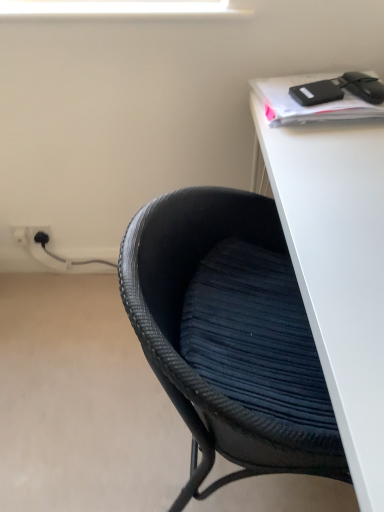
What do you see at coordinates (229, 334) in the screenshot? Image resolution: width=384 pixels, height=512 pixels. I see `black woven chair at lower left` at bounding box center [229, 334].

What do you see at coordinates (31, 234) in the screenshot?
I see `white plastic electric outlet at lower left, the 2th electric outlet when ordered from left to right` at bounding box center [31, 234].

The image size is (384, 512). I want to click on white matte desk at upper right, so click(x=334, y=259).

Identify the location of white plastic electric outlet at lower left, the 2th electric outlet when ordered from right to left. (20, 234).

Based on the photo, from the image's perspective, which is below, white plastic electric outlet at lower left, the 2th electric outlet when ordered from right to left, or white matte desk at upper right?

white matte desk at upper right is shown below in the image.

From a real-world perspective, is white plastic electric outlet at lower left, which ranks as the first electric outlet in left-to-right order, on white matte desk at upper right?

Actually, white plastic electric outlet at lower left, which ranks as the first electric outlet in left-to-right order, is physically below white matte desk at upper right in the real world.

Which is more to the right, white plastic electric outlet at lower left, which ranks as the first electric outlet in left-to-right order, or white matte desk at upper right?

white matte desk at upper right.

Looking at this image, considering the positions of objects white plastic electric outlet at lower left, which ranks as the first electric outlet in right-to-left order, and black woven chair at lower left in the image provided, who is more to the left, white plastic electric outlet at lower left, which ranks as the first electric outlet in right-to-left order, or black woven chair at lower left?

Positioned to the left is white plastic electric outlet at lower left, which ranks as the first electric outlet in right-to-left order.

Is white plastic electric outlet at lower left, the 2th electric outlet when ordered from left to right, positioned beyond the bounds of black woven chair at lower left?

Yes.

Is white plastic electric outlet at lower left, which ranks as the first electric outlet in right-to-left order, aimed at black woven chair at lower left?

No, white plastic electric outlet at lower left, which ranks as the first electric outlet in right-to-left order, is not aimed at black woven chair at lower left.

From the image's perspective, would you say white plastic electric outlet at lower left, which ranks as the first electric outlet in right-to-left order, is shown under black woven chair at lower left?

No.

Find the location of a particular element. electric outlet below the white plastic electric outlet at lower left, the 2th electric outlet when ordered from left to right (from a real-world perspective) is located at coordinates (20, 234).

Considering the points (42, 243) and (14, 234), which point is in front, point (42, 243) or point (14, 234)?

The point (14, 234) is closer.

Is white plastic electric outlet at lower left, which ranks as the first electric outlet in right-to-left order, placed right next to white plastic electric outlet at lower left, the 2th electric outlet when ordered from right to left?

Indeed, white plastic electric outlet at lower left, which ranks as the first electric outlet in right-to-left order, and white plastic electric outlet at lower left, the 2th electric outlet when ordered from right to left, are beside each other and touching.

Considering the sizes of objects white plastic electric outlet at lower left, which ranks as the first electric outlet in right-to-left order, and white plastic electric outlet at lower left, the 2th electric outlet when ordered from right to left, in the image provided, who is thinner, white plastic electric outlet at lower left, which ranks as the first electric outlet in right-to-left order, or white plastic electric outlet at lower left, the 2th electric outlet when ordered from right to left,?

white plastic electric outlet at lower left, which ranks as the first electric outlet in right-to-left order.

Which object is wider, white plastic electric outlet at lower left, which ranks as the first electric outlet in left-to-right order, or white plastic electric outlet at lower left, the 2th electric outlet when ordered from left to right?

With larger width is white plastic electric outlet at lower left, which ranks as the first electric outlet in left-to-right order.

The width and height of the screenshot is (384, 512). I want to click on electric outlet above the white plastic electric outlet at lower left, which ranks as the first electric outlet in left-to-right order (from the image's perspective), so click(x=31, y=234).

Is white plastic electric outlet at lower left, which ranks as the first electric outlet in left-to-right order, facing towards white plastic electric outlet at lower left, which ranks as the first electric outlet in right-to-left order?

No, white plastic electric outlet at lower left, which ranks as the first electric outlet in left-to-right order, is not facing towards white plastic electric outlet at lower left, which ranks as the first electric outlet in right-to-left order.

From the image's perspective, which one is positioned lower, white plastic electric outlet at lower left, the 2th electric outlet when ordered from right to left, or white plastic electric outlet at lower left, which ranks as the first electric outlet in right-to-left order?

white plastic electric outlet at lower left, the 2th electric outlet when ordered from right to left, appears lower in the image.

Locate an element on the screen. The width and height of the screenshot is (384, 512). the 1st electric outlet to the left of the white matte desk at upper right, starting your count from the anchor is located at coordinates (31, 234).

Considering the relative sizes of white matte desk at upper right and white plastic electric outlet at lower left, which ranks as the first electric outlet in right-to-left order, in the image provided, is white matte desk at upper right shorter than white plastic electric outlet at lower left, which ranks as the first electric outlet in right-to-left order,?

No, white matte desk at upper right is not shorter than white plastic electric outlet at lower left, which ranks as the first electric outlet in right-to-left order.

From a real-world perspective, is white matte desk at upper right physically above white plastic electric outlet at lower left, the 2th electric outlet when ordered from left to right?

Indeed, from a real-world perspective, white matte desk at upper right stands above white plastic electric outlet at lower left, the 2th electric outlet when ordered from left to right.

Which object is more forward, white matte desk at upper right or white plastic electric outlet at lower left, the 2th electric outlet when ordered from left to right?

white matte desk at upper right is closer to the camera.

From a real-world perspective, which is physically below, black woven chair at lower left or white matte desk at upper right?

black woven chair at lower left is physically lower.

Where is `desk in front of the black woven chair at lower left`? This screenshot has height=512, width=384. desk in front of the black woven chair at lower left is located at coordinates (334, 259).

From the image's perspective, would you say black woven chair at lower left is shown under white matte desk at upper right?

Yes.

Can you confirm if black woven chair at lower left is positioned to the right of white matte desk at upper right?

In fact, black woven chair at lower left is to the left of white matte desk at upper right.

Is white plastic electric outlet at lower left, the 2th electric outlet when ordered from left to right, surrounding white matte desk at upper right?

That's incorrect, white matte desk at upper right is not inside white plastic electric outlet at lower left, the 2th electric outlet when ordered from left to right.

Is white plastic electric outlet at lower left, which ranks as the first electric outlet in right-to-left order, facing towards white matte desk at upper right?

No.

From their relative heights in the image, would you say white plastic electric outlet at lower left, the 2th electric outlet when ordered from left to right, is taller or shorter than white matte desk at upper right?

Considering their sizes, white plastic electric outlet at lower left, the 2th electric outlet when ordered from left to right, has less height than white matte desk at upper right.

From the image's perspective, between white plastic electric outlet at lower left, which ranks as the first electric outlet in right-to-left order, and white matte desk at upper right, which one is located above?

white plastic electric outlet at lower left, which ranks as the first electric outlet in right-to-left order.

The image size is (384, 512). What are the coordinates of `desk below the white plastic electric outlet at lower left, which ranks as the first electric outlet in left-to-right order (from the image's perspective)` in the screenshot? It's located at (334, 259).

You are a GUI agent. You are given a task and a screenshot of the screen. Output one action in this format:
    pyautogui.click(x=<x>, y=<y>)
    Task: Click on the 2nd electric outlet above when counting from the black woven chair at lower left (from the image's perspective)
    The image size is (384, 512).
    Given the screenshot: What is the action you would take?
    pyautogui.click(x=31, y=234)

From the image, which object appears to be nearer to white matte desk at upper right, white plastic electric outlet at lower left, which ranks as the first electric outlet in right-to-left order, or white plastic electric outlet at lower left, which ranks as the first electric outlet in left-to-right order?

white plastic electric outlet at lower left, which ranks as the first electric outlet in right-to-left order.

When comparing their distances from white matte desk at upper right, does black woven chair at lower left or white plastic electric outlet at lower left, which ranks as the first electric outlet in right-to-left order, seem further?

white plastic electric outlet at lower left, which ranks as the first electric outlet in right-to-left order, is further to white matte desk at upper right.

Which object lies further to the anchor point white plastic electric outlet at lower left, the 2th electric outlet when ordered from left to right, white matte desk at upper right or white plastic electric outlet at lower left, which ranks as the first electric outlet in left-to-right order?

Based on the image, white matte desk at upper right appears to be further to white plastic electric outlet at lower left, the 2th electric outlet when ordered from left to right.

Based on their spatial positions, is white matte desk at upper right or white plastic electric outlet at lower left, which ranks as the first electric outlet in right-to-left order, closer to white plastic electric outlet at lower left, which ranks as the first electric outlet in left-to-right order?

white plastic electric outlet at lower left, which ranks as the first electric outlet in right-to-left order, is positioned closer to the anchor white plastic electric outlet at lower left, which ranks as the first electric outlet in left-to-right order.

Which object lies further to the anchor point black woven chair at lower left, white matte desk at upper right or white plastic electric outlet at lower left, which ranks as the first electric outlet in left-to-right order?

The object further to black woven chair at lower left is white plastic electric outlet at lower left, which ranks as the first electric outlet in left-to-right order.

Considering their positions, is white plastic electric outlet at lower left, which ranks as the first electric outlet in left-to-right order, positioned further to white plastic electric outlet at lower left, the 2th electric outlet when ordered from left to right, than black woven chair at lower left?

black woven chair at lower left is positioned further to the anchor white plastic electric outlet at lower left, the 2th electric outlet when ordered from left to right.

Estimate the real-world distances between objects in this image. Which object is further from white matte desk at upper right, black woven chair at lower left or white plastic electric outlet at lower left, the 2th electric outlet when ordered from right to left?

Based on the image, white plastic electric outlet at lower left, the 2th electric outlet when ordered from right to left, appears to be further to white matte desk at upper right.

Which object lies further to the anchor point white plastic electric outlet at lower left, the 2th electric outlet when ordered from left to right, white matte desk at upper right or black woven chair at lower left?

The object further to white plastic electric outlet at lower left, the 2th electric outlet when ordered from left to right, is white matte desk at upper right.

The width and height of the screenshot is (384, 512). I want to click on electric outlet positioned between white matte desk at upper right and white plastic electric outlet at lower left, the 2th electric outlet when ordered from right to left, from near to far, so click(31, 234).

Where is `electric outlet between black woven chair at lower left and white plastic electric outlet at lower left, which ranks as the first electric outlet in left-to-right order, from front to back`? The image size is (384, 512). electric outlet between black woven chair at lower left and white plastic electric outlet at lower left, which ranks as the first electric outlet in left-to-right order, from front to back is located at coordinates (31, 234).

The height and width of the screenshot is (512, 384). Find the location of `chair between white matte desk at upper right and white plastic electric outlet at lower left, the 2th electric outlet when ordered from left to right, in the front-back direction`. chair between white matte desk at upper right and white plastic electric outlet at lower left, the 2th electric outlet when ordered from left to right, in the front-back direction is located at coordinates (229, 334).

Image resolution: width=384 pixels, height=512 pixels. Find the location of `chair between white matte desk at upper right and white plastic electric outlet at lower left, which ranks as the first electric outlet in left-to-right order, in the front-back direction`. chair between white matte desk at upper right and white plastic electric outlet at lower left, which ranks as the first electric outlet in left-to-right order, in the front-back direction is located at coordinates (229, 334).